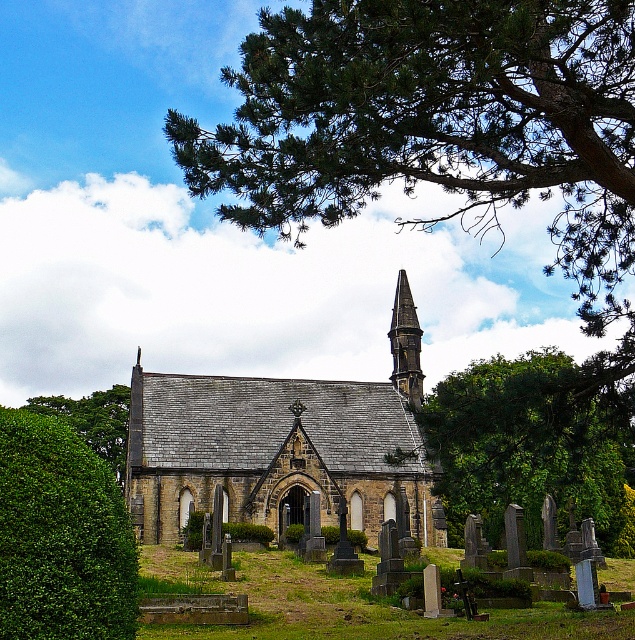
Question: Estimate the real-world distances between objects in this image. Which object is farther from the dark gray stone spire at center?

Choices:
 (A) green grass at center
 (B) stone gray church at center

Answer: (A)

Question: Which of these objects is positioned closest to the green grass at center?

Choices:
 (A) dark gray stone spire at center
 (B) green leafy bush at lower left
 (C) green leafy tree at upper center

Answer: (C)

Question: Is green leafy tree at upper center closer to the viewer compared to dark gray stone spire at center?

Choices:
 (A) no
 (B) yes

Answer: (B)

Question: Is green grass at center smaller than green leafy bush at lower left?

Choices:
 (A) no
 (B) yes

Answer: (B)

Question: Can you confirm if green leafy tree at upper center is positioned to the left of stone gray church at center?

Choices:
 (A) yes
 (B) no

Answer: (B)

Question: Which point is farther from the camera taking this photo?

Choices:
 (A) (29, 598)
 (B) (51, 406)
 (C) (622, 572)

Answer: (B)